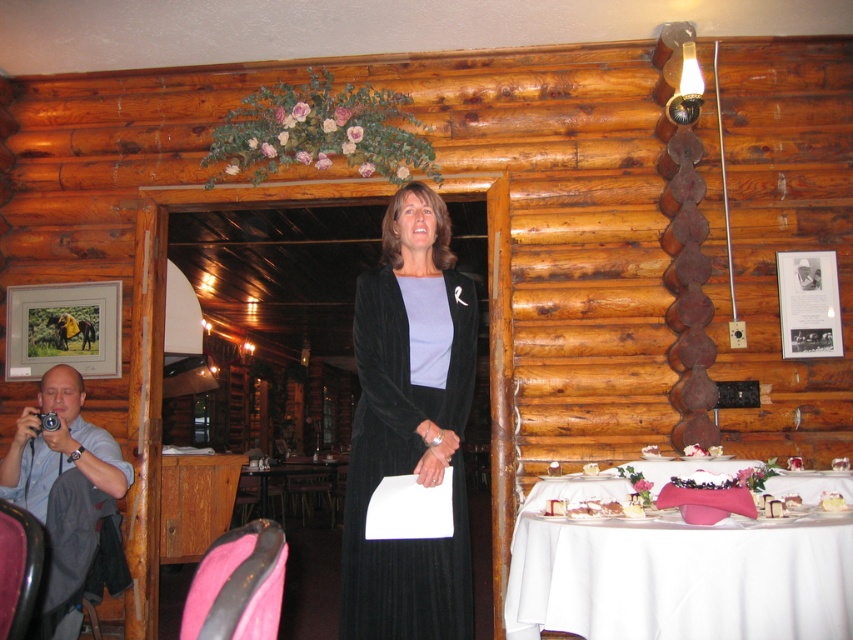
You are organizing a charity event and need to determine which clothing item requires more storage space. Based on the image, which item is larger in size between the black velvet dress at center and the blue shirt at left?

The blue shirt at left is larger in size compared to the black velvet dress at center, so it would require more storage space.

You are standing inside the rustic wooden cabin and see two points marked on the floor. The first point is at coordinate point (740,570) and the second is at point (78,381). Which point is closer to the entrance where the woman is standing?

Point (740,570) is in front of point (78,381), so it is closer to the entrance where the woman is standing.

You are organizing a formal event and need to locate the black velvet dress at center. According to the coordinates provided, where would you find it in the image?

The black velvet dress at center is located at coordinates point (390, 474).